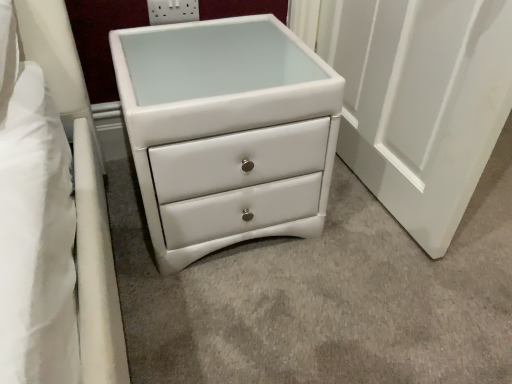
Question: Considering the relative sizes of white plastic socket at upper center and white leather chest of drawers at center in the image provided, is white plastic socket at upper center smaller than white leather chest of drawers at center?

Choices:
 (A) no
 (B) yes

Answer: (B)

Question: Would you consider white plastic socket at upper center to be distant from white leather chest of drawers at center?

Choices:
 (A) yes
 (B) no

Answer: (B)

Question: Is the position of white plastic socket at upper center less distant than that of white leather chest of drawers at center?

Choices:
 (A) no
 (B) yes

Answer: (A)

Question: Does white plastic socket at upper center have a greater width compared to white leather chest of drawers at center?

Choices:
 (A) yes
 (B) no

Answer: (B)

Question: Considering the relative positions of white plastic socket at upper center and white leather chest of drawers at center in the image provided, is white plastic socket at upper center to the right of white leather chest of drawers at center from the viewer's perspective?

Choices:
 (A) yes
 (B) no

Answer: (B)

Question: Can you confirm if white plastic socket at upper center is thinner than white leather chest of drawers at center?

Choices:
 (A) yes
 (B) no

Answer: (A)

Question: From the image's perspective, does white leather chest of drawers at center appear lower than white plastic socket at upper center?

Choices:
 (A) yes
 (B) no

Answer: (A)

Question: Is white leather chest of drawers at center thinner than white plastic socket at upper center?

Choices:
 (A) no
 (B) yes

Answer: (A)

Question: From a real-world perspective, is white leather chest of drawers at center physically below white plastic socket at upper center?

Choices:
 (A) yes
 (B) no

Answer: (A)

Question: Does white leather chest of drawers at center have a smaller size compared to white plastic socket at upper center?

Choices:
 (A) no
 (B) yes

Answer: (A)

Question: Is white leather chest of drawers at center closer to the viewer compared to white plastic socket at upper center?

Choices:
 (A) no
 (B) yes

Answer: (B)

Question: Does white leather chest of drawers at center have a greater width compared to white plastic socket at upper center?

Choices:
 (A) yes
 (B) no

Answer: (A)

Question: From a real-world perspective, relative to white plastic socket at upper center, is white leather chest of drawers at center vertically above or below?

Choices:
 (A) above
 (B) below

Answer: (B)